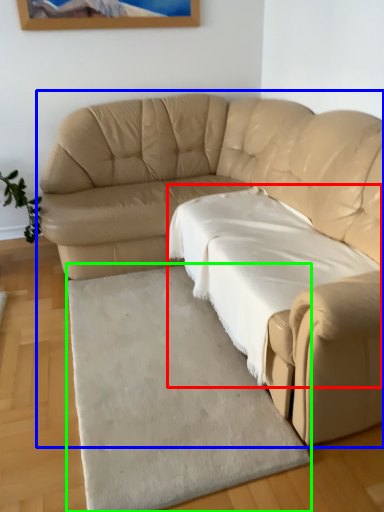
Question: Estimate the real-world distances between objects in this image. Which object is farther from sheet (highlighted by a red box), studio couch (highlighted by a blue box) or mat (highlighted by a green box)?

Choices:
 (A) studio couch
 (B) mat

Answer: (B)